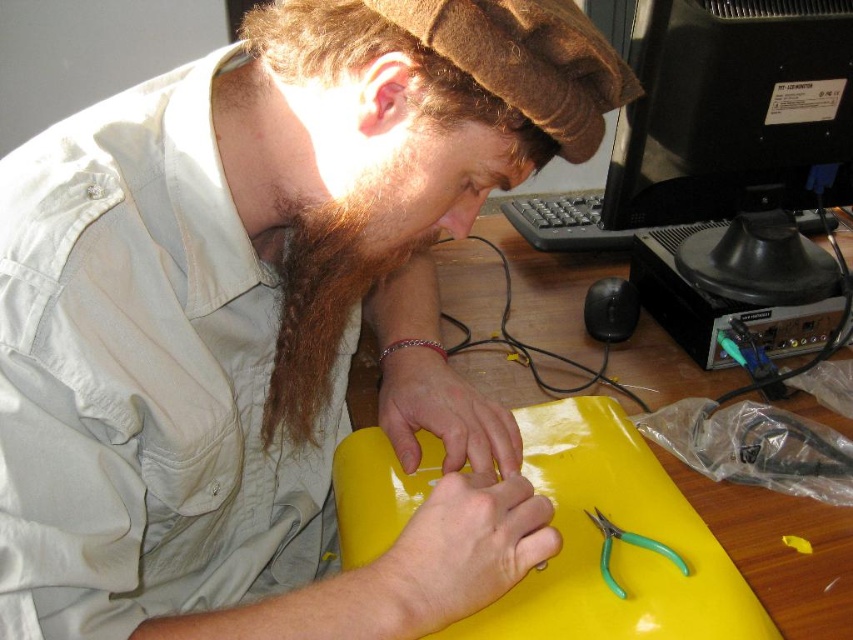
You are a photographer taking a closeup shot of the person at the desk. You notice the brown fuzzy beard at center and the yellow plastic wire at center. Which object is shorter in height?

The brown fuzzy beard at center is shorter in height than the yellow plastic wire at center.

You are a worker who needs to access the yellow plastic wire at center. The yellow glossy table at center is blocking your path. Can you move the table to reach the wire?

The yellow glossy table at center is in front of the yellow plastic wire at center, so moving the table would allow you to access the yellow plastic wire at center.